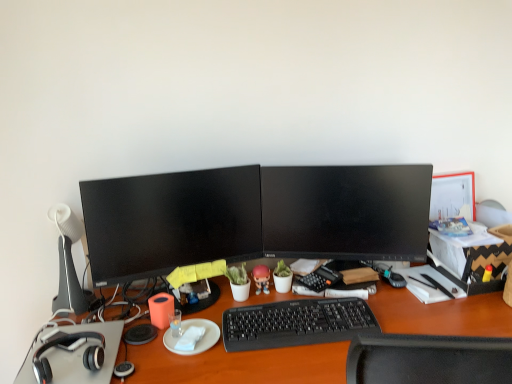
Locate an element on the screen. The height and width of the screenshot is (384, 512). free space above wooden desk at center (from a real-world perspective) is located at coordinates coord(286,339).